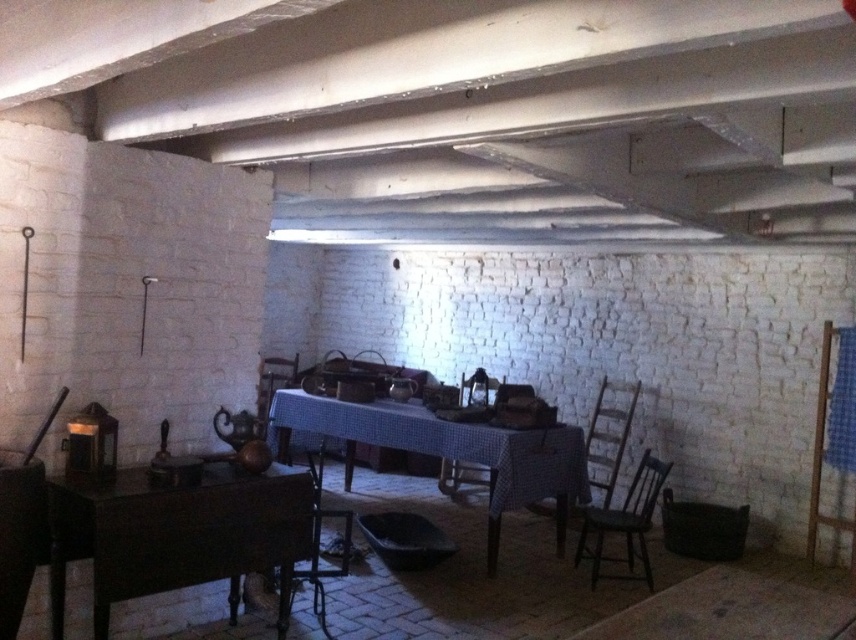
Question: From the image, what is the correct spatial relationship of dark brown wooden chair at lower right in relation to wooden chair at lower left?

Choices:
 (A) below
 (B) above

Answer: (B)

Question: Can you confirm if blue checkered tablecloth at center is positioned above wooden chair at lower left?

Choices:
 (A) yes
 (B) no

Answer: (A)

Question: Does wooden chair at lower left have a larger size compared to wooden chair at center?

Choices:
 (A) yes
 (B) no

Answer: (A)

Question: Which point appears closest to the camera in this image?

Choices:
 (A) (646, 568)
 (B) (250, 598)

Answer: (B)

Question: Which point is farther from the camera taking this photo?

Choices:
 (A) (406, 426)
 (B) (122, 573)
 (C) (632, 496)
 (D) (452, 483)

Answer: (D)

Question: Which point appears farthest from the camera in this image?

Choices:
 (A) (557, 477)
 (B) (313, 483)
 (C) (532, 396)

Answer: (C)